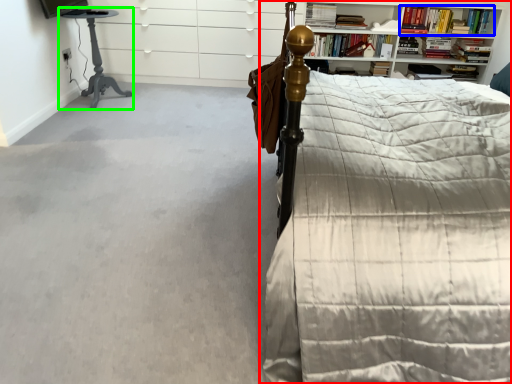
Question: Which is farther away from bed (highlighted by a red box)? book (highlighted by a blue box) or table (highlighted by a green box)?

Choices:
 (A) book
 (B) table

Answer: (A)